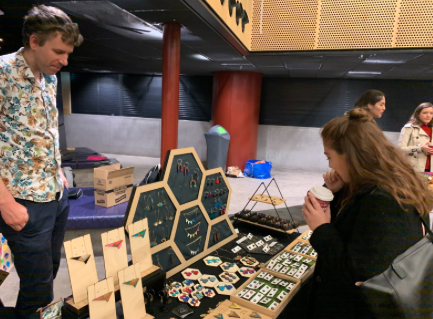
Image resolution: width=433 pixels, height=319 pixels. I want to click on black window blinds - closed, so click(141, 92).